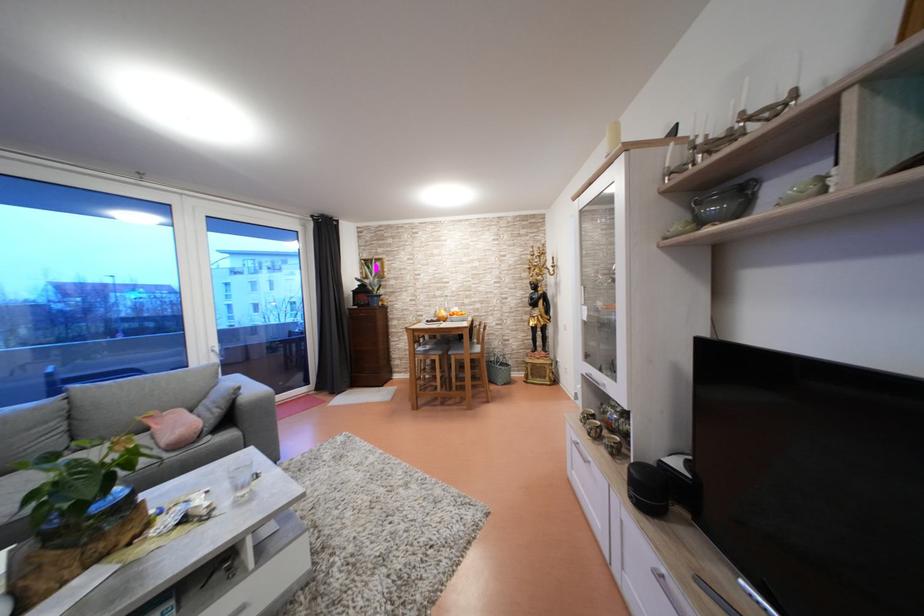
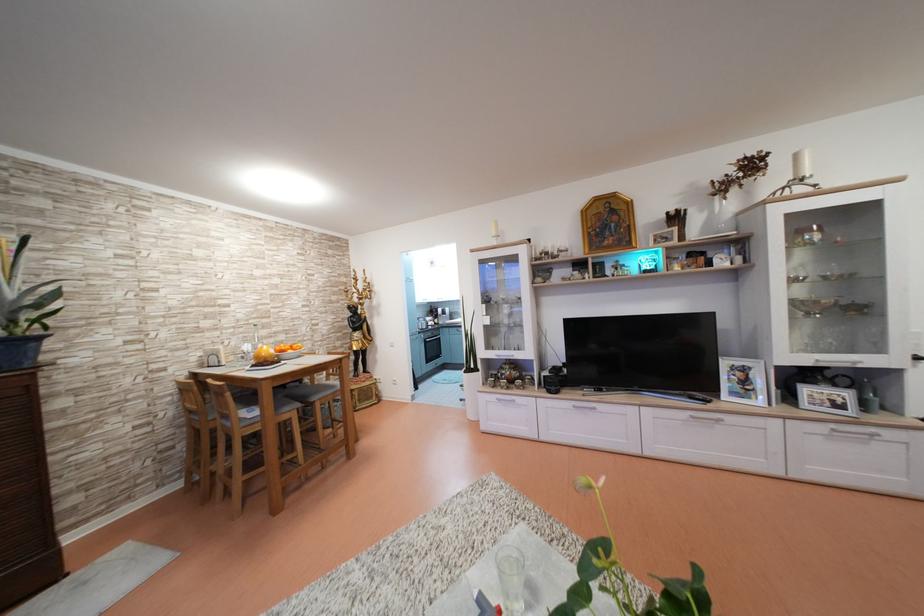
The point at (479, 313) is marked in the first image. Where is the corresponding point in the second image?

(280, 345)